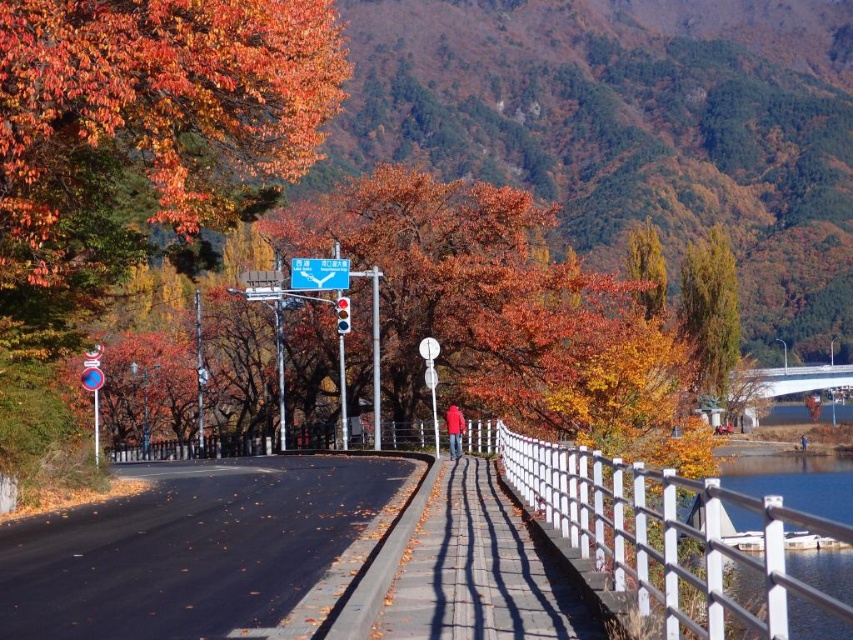
You are standing at the starting point of the pathway and want to reach a destination located at point (701, 337). There is an obstacle at point (647, 300). According to the scene description, can you walk directly to your destination without going around the obstacle?

Point (701, 337) is behind point (647, 300), so you cannot walk directly to your destination without going around the obstacle at point (647, 300) because the obstacle is in front of the destination.

Consider the image. You are standing at the point labeled as point (711, 310) in the image. Looking around, you see a green leafy tree at upper right. Which direction should you face to look towards the green leafy tree at upper right?

You are already at the point (711, 310) which is on the green leafy tree at upper right, so you are facing the tree itself.

You are standing on the pathway and want to cross to the other side of the road. The white concrete bridge at right is your only option. However, you notice the smooth glass water at right nearby. Is the bridge located to the left or right of the water?

The smooth glass water at right is to the left of the white concrete bridge at right, so the bridge is to the right of the water.